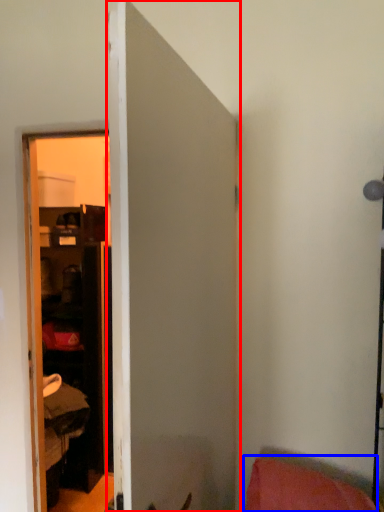
Question: Which of the following is the closest to the observer, door (highlighted by a red box) or pillow (highlighted by a blue box)?

Choices:
 (A) door
 (B) pillow

Answer: (A)